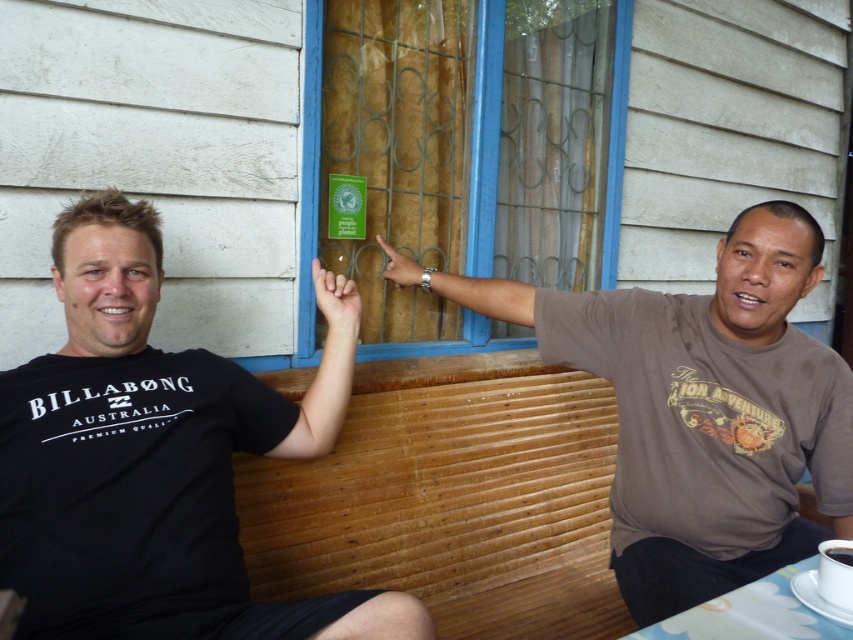
Question: Is the position of brown cotton shirt at center more distant than that of white plastic table at lower right?

Choices:
 (A) yes
 (B) no

Answer: (A)

Question: Which is nearer to the black matte cup at lower right?

Choices:
 (A) black t-shirt at left
 (B) brown cotton shirt at center
 (C) smooth skin hand at center
 (D) white plastic table at lower right

Answer: (D)

Question: Is black t-shirt at left smaller than green matte sign at upper center?

Choices:
 (A) yes
 (B) no

Answer: (B)

Question: Among these points, which one is nearest to the camera?

Choices:
 (A) (849, 556)
 (B) (682, 499)

Answer: (A)

Question: Is black t-shirt at left above brown cotton shirt at center?

Choices:
 (A) yes
 (B) no

Answer: (B)

Question: Which is farther from the black matte cup at lower right?

Choices:
 (A) smooth skin hand at center
 (B) brown cotton shirt at center
 (C) white plastic table at lower right

Answer: (A)